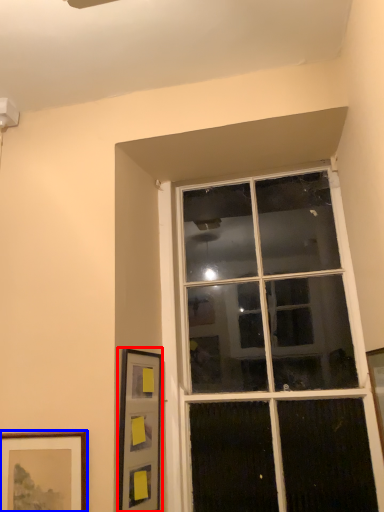
Question: Which object appears closest to the camera in this image, picture frame (highlighted by a red box) or picture frame (highlighted by a blue box)?

Choices:
 (A) picture frame
 (B) picture frame

Answer: (B)